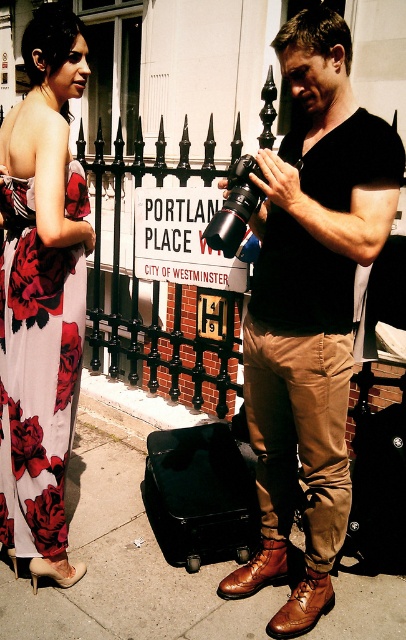
Does brown leather shoes at lower center have a larger size compared to floral printed fabric dress at left?

Correct, brown leather shoes at lower center is larger in size than floral printed fabric dress at left.

Looking at this image, can you confirm if brown leather shoes at lower center is shorter than floral printed fabric dress at left?

Correct, brown leather shoes at lower center is not as tall as floral printed fabric dress at left.

Measure the distance between brown leather shoes at lower center and camera.

A distance of 6.33 feet exists between brown leather shoes at lower center and camera.

Where is `brown leather shoes at lower center`? The width and height of the screenshot is (406, 640). brown leather shoes at lower center is located at coordinates (125, 545).

Can you confirm if matte black shirt at center is positioned below black matte suitcase at center?

Incorrect, matte black shirt at center is not positioned below black matte suitcase at center.

Does matte black shirt at center have a greater height compared to black matte suitcase at center?

Yes, matte black shirt at center is taller than black matte suitcase at center.

Who is more distant from viewer, (282,294) or (205,499)?

The point (205,499) is more distant.

Identify the location of matte black shirt at center. (310, 308).

Can you confirm if brown leather shoes at lower center is positioned below black matte suitcase at center?

Yes.

Does brown leather shoes at lower center lie behind black matte suitcase at center?

That is False.

Image resolution: width=406 pixels, height=640 pixels. Describe the element at coordinates (125, 545) in the screenshot. I see `brown leather shoes at lower center` at that location.

Locate an element on the screen. brown leather shoes at lower center is located at coordinates (125, 545).